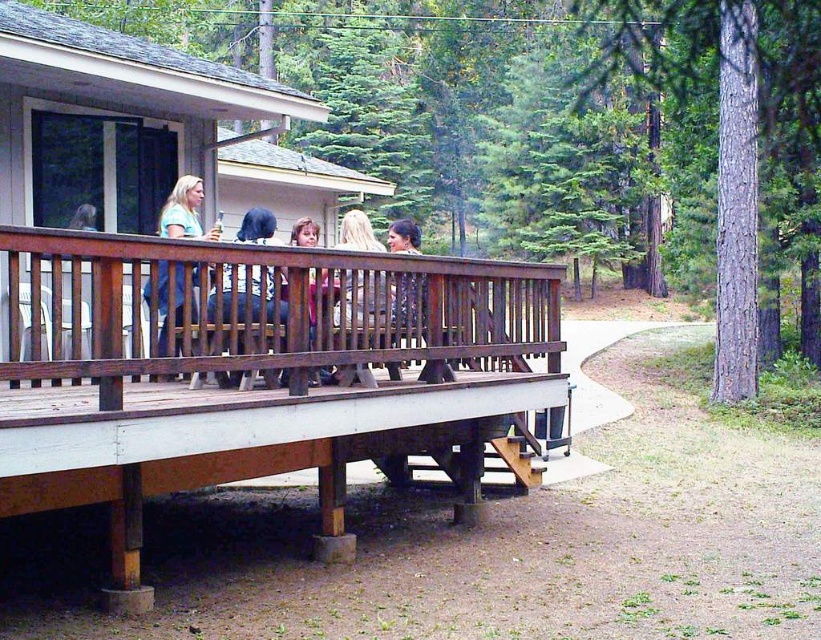
Question: Is dark blue fabric at center positioned before smooth brown shirt at center?

Choices:
 (A) yes
 (B) no

Answer: (A)

Question: Among these objects, which one is nearest to the camera?

Choices:
 (A) smooth brown shirt at center
 (B) wooden bench at center

Answer: (A)

Question: Which point is farther to the camera?

Choices:
 (A) (159, 308)
 (B) (365, 273)
 (C) (315, 291)

Answer: (B)

Question: Does matte blue shirt at upper center appear on the right side of matte pink shirt at center?

Choices:
 (A) yes
 (B) no

Answer: (B)

Question: Is brown wood deck at center below dark blue fabric at center?

Choices:
 (A) yes
 (B) no

Answer: (A)

Question: Which of the following is the closest to the observer?

Choices:
 (A) blonde hair at center
 (B) brown wooden cabin at center
 (C) dark blue fabric at center
 (D) wooden bench at center

Answer: (C)